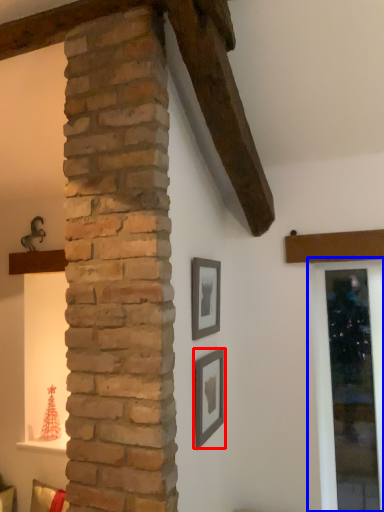
Question: Which point is closer to the camera, picture frame (highlighted by a red box) or window frame (highlighted by a blue box)?

Choices:
 (A) picture frame
 (B) window frame

Answer: (A)